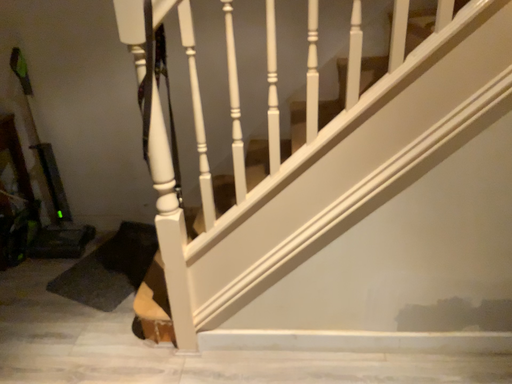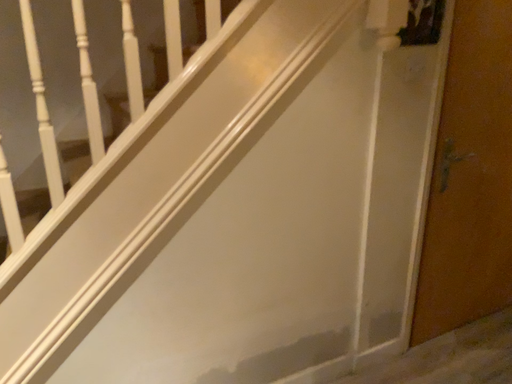
Question: Which way did the camera rotate in the video?

Choices:
 (A) rotated left
 (B) rotated right

Answer: (B)